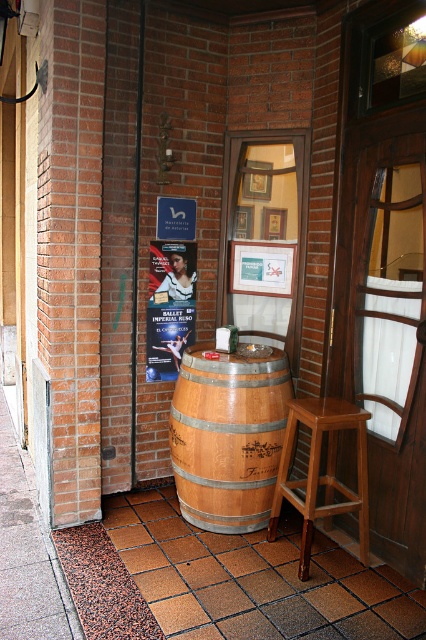
Where is `brown tile pavement at lower center`? Image resolution: width=426 pixels, height=640 pixels. brown tile pavement at lower center is located at coordinates (253, 579).

Can you confirm if brown tile pavement at lower center is thinner than light brown wooden bar stool at center?

No.

Between point (124, 554) and point (285, 448), which one is positioned behind?

Positioned behind is point (285, 448).

The image size is (426, 640). I want to click on brown tile pavement at lower center, so click(x=253, y=579).

Measure the distance between brown tile pavement at lower center and matte paper poster at center.

brown tile pavement at lower center is 1.27 meters away from matte paper poster at center.

Who is more forward, (181, 605) or (167, 344)?

Point (181, 605) is in front.

Between point (181, 637) and point (176, 364), which one is positioned behind?

The point (176, 364) is more distant.

Where is `brown tile pavement at lower center`? Image resolution: width=426 pixels, height=640 pixels. brown tile pavement at lower center is located at coordinates (253, 579).

Can you confirm if wooden barrel at center is positioned to the left of matte paper poster at center?

No, wooden barrel at center is not to the left of matte paper poster at center.

Who is more forward, (222, 497) or (183, 324)?

Point (222, 497)

Does point (239, 490) come farther from viewer compared to point (178, 307)?

No.

I want to click on wooden barrel at center, so click(x=227, y=436).